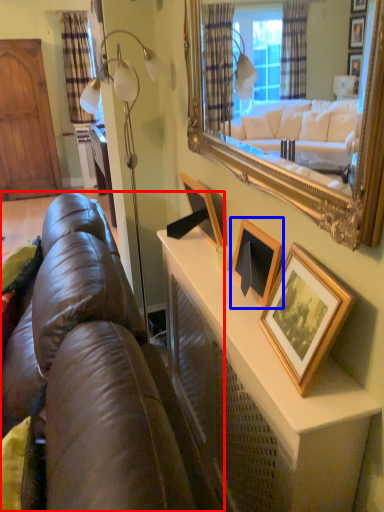
Question: Which object is closer to the camera taking this photo, studio couch (highlighted by a red box) or picture frame (highlighted by a blue box)?

Choices:
 (A) studio couch
 (B) picture frame

Answer: (A)